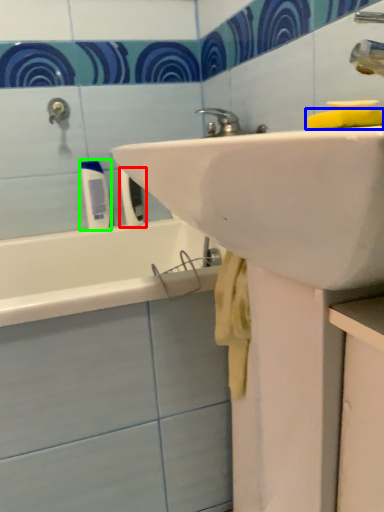
Question: Which object is positioned closest to toiletry (highlighted by a red box)? Select from soap (highlighted by a blue box) and toiletry (highlighted by a green box).

Choices:
 (A) soap
 (B) toiletry

Answer: (B)